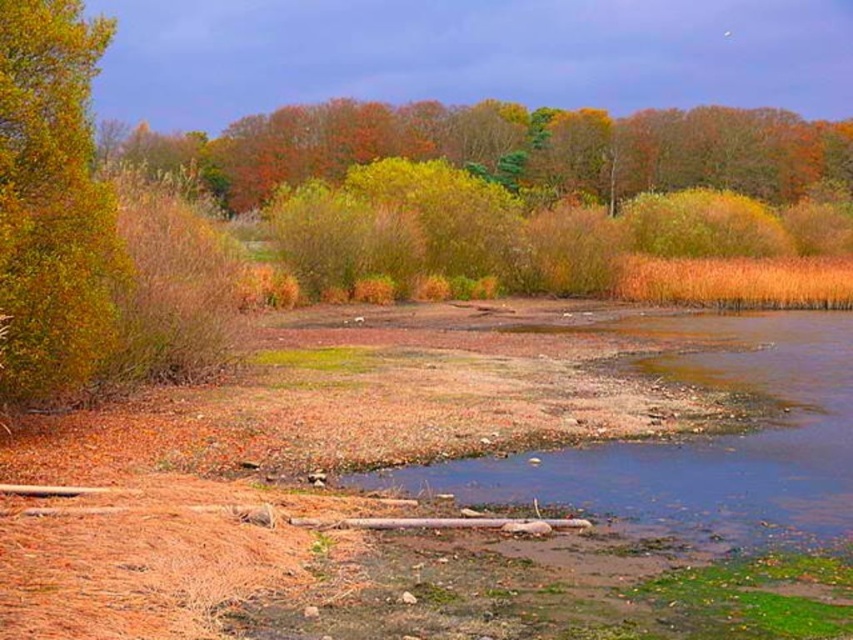
Does autumn leaves at upper center have a lesser height compared to golden textured bush at left?

In fact, autumn leaves at upper center may be taller than golden textured bush at left.

Is autumn leaves at upper center smaller than golden textured bush at left?

Actually, autumn leaves at upper center might be larger than golden textured bush at left.

Who is more distant from viewer, (229, 173) or (38, 273)?

Positioned behind is point (229, 173).

The height and width of the screenshot is (640, 853). Identify the location of autumn leaves at upper center. (514, 148).